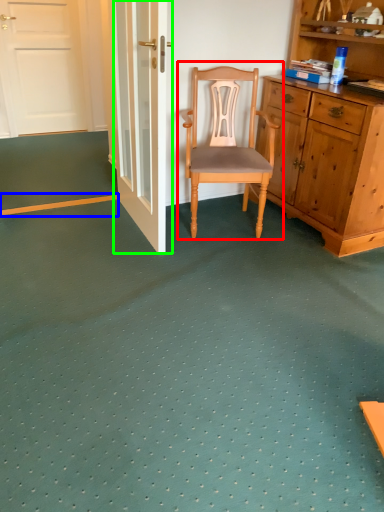
Question: Which object is positioned farthest from chair (highlighted by a red box)? Select from strip (highlighted by a blue box) and door (highlighted by a green box).

Choices:
 (A) strip
 (B) door

Answer: (A)